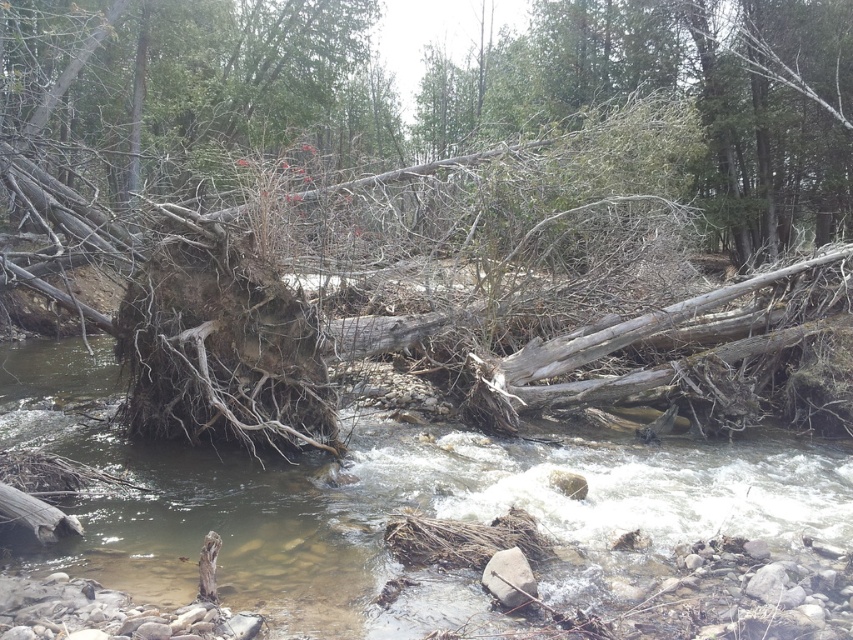
You are a hiker trying to cross the stream using the brown wood at center and the gray rough rock at center. Which one is wider and can support your weight better?

The brown wood at center is wider than the gray rough rock at center, so it can support your weight better.

You are a hiker trying to cross the stream. You see the brown wood at center and the gray rough rock at center. Which object is higher in the water?

The brown wood at center is above the gray rough rock at center, so the brown wood at center is higher in the water.